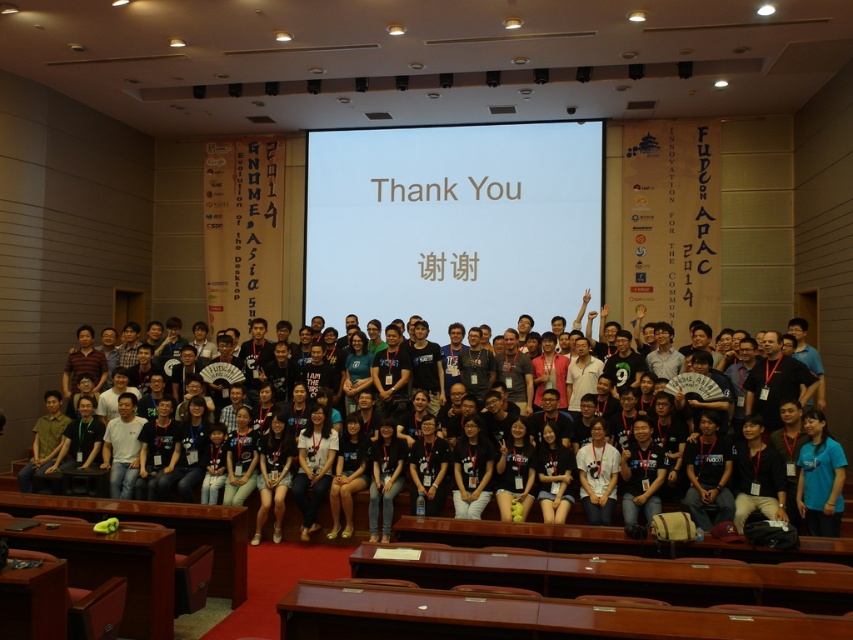
Question: Which of the following is the closest to the observer?

Choices:
 (A) (825, 464)
 (B) (466, 429)
 (C) (289, 449)

Answer: (A)

Question: Is black fabric shirt at center positioned behind dark blue t-shirt at center?

Choices:
 (A) yes
 (B) no

Answer: (B)

Question: Based on their relative distances, which object is farther from the dark blue t-shirt at center?

Choices:
 (A) black fabric shirt at center
 (B) blue fabric shirt at lower right
 (C) black matte shirt at center

Answer: (B)

Question: Is white matte projection screen at center thinner than black fabric shirt at center?

Choices:
 (A) yes
 (B) no

Answer: (A)

Question: Does blue fabric shirt at lower right lie behind dark blue t-shirt at center?

Choices:
 (A) no
 (B) yes

Answer: (A)

Question: Considering the real-world distances, which object is farthest from the blue fabric shirt at lower right?

Choices:
 (A) black fabric shirt at center
 (B) black matte shirt at center
 (C) dark blue t-shirt at center
 (D) white matte projection screen at center

Answer: (D)